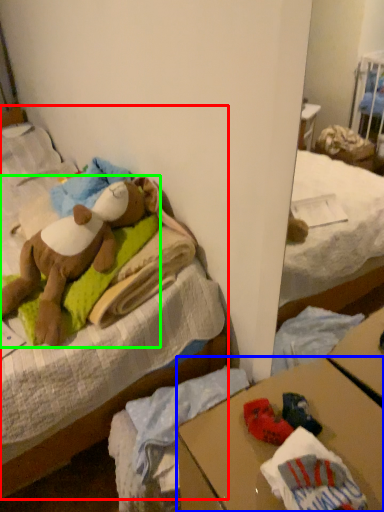
Question: Which object is positioned closest to bed (highlighted by a red box)? Select from desk (highlighted by a blue box) and teddy bear (highlighted by a green box).

Choices:
 (A) desk
 (B) teddy bear

Answer: (B)